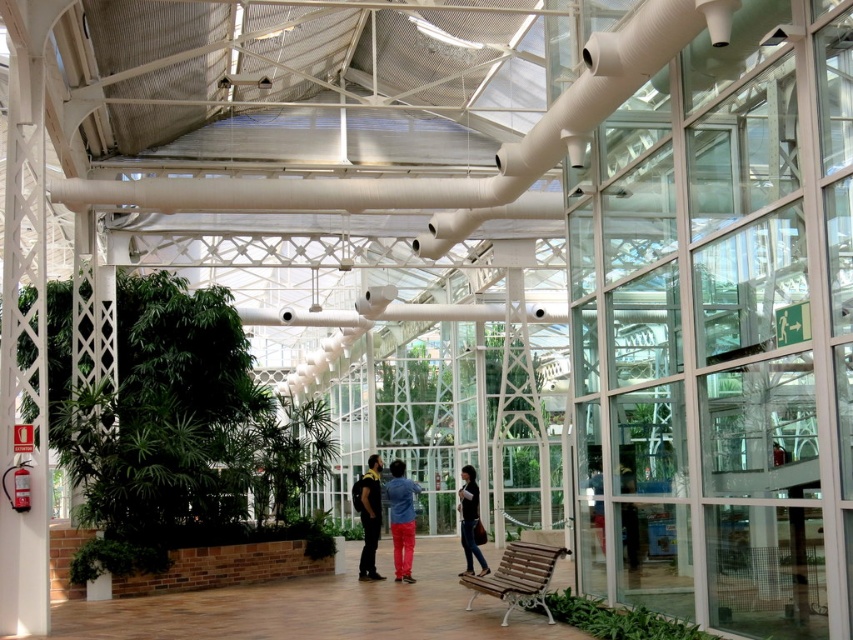
Is green leafy plant at left closer to camera compared to green leafy plant at lower right?

That is False.

Does green leafy plant at left have a greater width compared to green leafy plant at lower right?

No, green leafy plant at left is not wider than green leafy plant at lower right.

What do you see at coordinates (178, 433) in the screenshot? I see `green leafy plant at left` at bounding box center [178, 433].

Where is `green leafy plant at left`? This screenshot has width=853, height=640. green leafy plant at left is located at coordinates click(178, 433).

Which is below, brown wooden bench at lower right or denim jacket at center?

Positioned lower is brown wooden bench at lower right.

The height and width of the screenshot is (640, 853). In order to click on brown wooden bench at lower right in this screenshot , I will do `click(518, 577)`.

Is point (500, 573) positioned after point (399, 557)?

That is False.

You are a GUI agent. You are given a task and a screenshot of the screen. Output one action in this format:
    pyautogui.click(x=<x>, y=<y>)
    Task: Click on the brown wooden bench at lower right
    The image size is (853, 640).
    Given the screenshot: What is the action you would take?
    pyautogui.click(x=518, y=577)

Based on the photo, is green leafy plant at lower right below dark blue jeans at center?

A: Actually, green leafy plant at lower right is above dark blue jeans at center.

Is the position of green leafy plant at lower right less distant than that of dark blue jeans at center?

Yes, green leafy plant at lower right is in front of dark blue jeans at center.

Identify the location of green leafy plant at lower right. (618, 620).